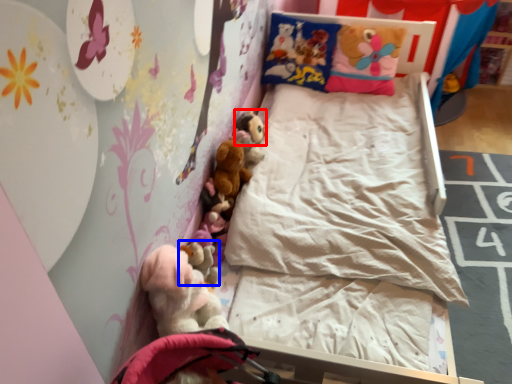
Question: Which object is further to the camera taking this photo, toy (highlighted by a red box) or toy (highlighted by a blue box)?

Choices:
 (A) toy
 (B) toy

Answer: (A)